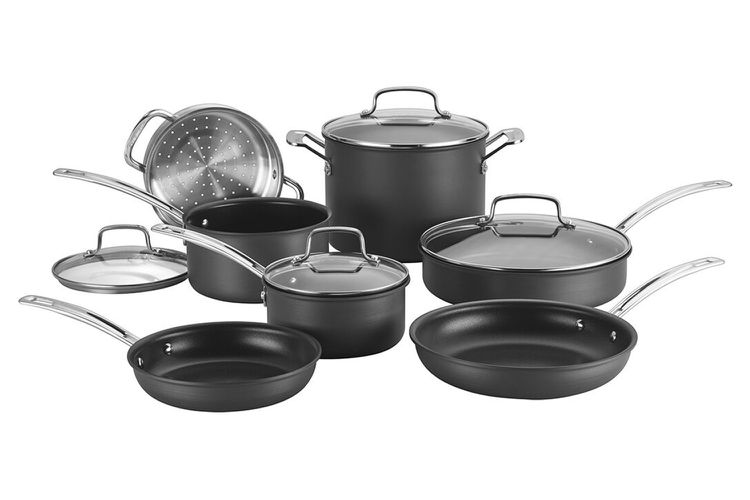
The height and width of the screenshot is (500, 750). In order to click on handles in this screenshot , I will do `click(300, 140)`, `click(508, 129)`, `click(150, 196)`, `click(182, 232)`, `click(94, 316)`, `click(154, 114)`, `click(296, 186)`, `click(676, 200)`, `click(676, 276)`.